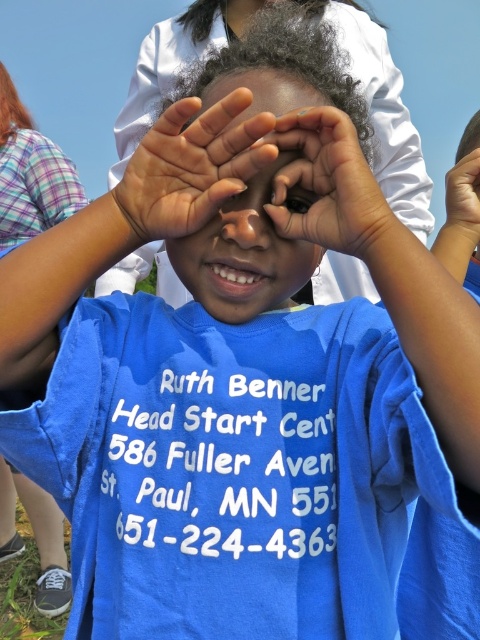
Can you confirm if smooth skin face at center is positioned to the left of palm skin at center?

Incorrect, smooth skin face at center is not on the left side of palm skin at center.

Between smooth skin face at center and palm skin at center, which one is positioned lower?

smooth skin face at center

Between point (277, 196) and point (153, 150), which one is positioned in front?

Point (153, 150)

Find the location of a particular element. The height and width of the screenshot is (640, 480). smooth skin face at center is located at coordinates (244, 230).

The height and width of the screenshot is (640, 480). What do you see at coordinates (244, 230) in the screenshot? I see `smooth skin face at center` at bounding box center [244, 230].

Which is behind, point (228, 200) or point (321, 124)?

Point (228, 200)

Is point (211, 257) positioned before point (321, 225)?

No.

What are the coordinates of `smooth skin face at center` in the screenshot? It's located at (244, 230).

Can you confirm if smooth skin hand at upper right is thinner than black matte eye at center?

In fact, smooth skin hand at upper right might be wider than black matte eye at center.

What do you see at coordinates (463, 204) in the screenshot? I see `smooth skin hand at upper right` at bounding box center [463, 204].

Where is `smooth skin hand at upper right`? Image resolution: width=480 pixels, height=640 pixels. smooth skin hand at upper right is located at coordinates (463, 204).